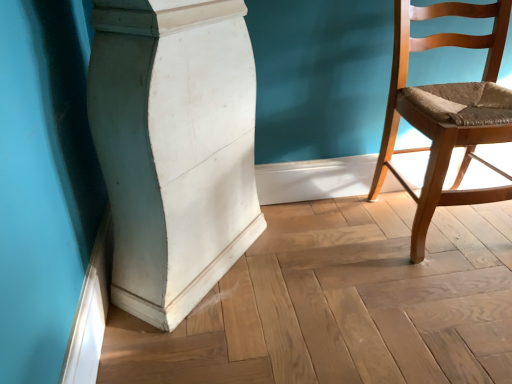
This screenshot has width=512, height=384. What do you see at coordinates (438, 121) in the screenshot?
I see `light brown wooden chair at right` at bounding box center [438, 121].

Where is `light brown wooden chair at right`? light brown wooden chair at right is located at coordinates (438, 121).

What is the approximate width of white matte/wooden pillar at center?

The width of white matte/wooden pillar at center is 21.98 inches.

Based on the photo, in order to face white matte/wooden pillar at center, should I rotate leftwards or rightwards?

Turn left approximately 8.371 degrees to face it.

Image resolution: width=512 pixels, height=384 pixels. Describe the element at coordinates (174, 147) in the screenshot. I see `white matte/wooden pillar at center` at that location.

At what (x,y) coordinates should I click in order to perform the action: click on white matte/wooden pillar at center. Please return your answer as a coordinate pair (x, y). The height and width of the screenshot is (384, 512). Looking at the image, I should click on (174, 147).

Locate an element on the screen. light brown wooden chair at right is located at coordinates (438, 121).

Consider the image. Is light brown wooden chair at right to the left of white matte/wooden pillar at center from the viewer's perspective?

No, light brown wooden chair at right is not to the left of white matte/wooden pillar at center.

Relative to white matte/wooden pillar at center, is light brown wooden chair at right in front or behind?

Visually, light brown wooden chair at right is located behind white matte/wooden pillar at center.

Between point (462, 169) and point (139, 273), which one is positioned behind?

Point (462, 169)

From the image's perspective, is light brown wooden chair at right under white matte/wooden pillar at center?

No, from the image's perspective, light brown wooden chair at right is not below white matte/wooden pillar at center.

From a real-world perspective, is light brown wooden chair at right physically above white matte/wooden pillar at center?

Incorrect, from a real-world perspective, light brown wooden chair at right is lower than white matte/wooden pillar at center.

Does light brown wooden chair at right have a greater width compared to white matte/wooden pillar at center?

Incorrect, the width of light brown wooden chair at right does not surpass that of white matte/wooden pillar at center.

Considering the sizes of objects light brown wooden chair at right and white matte/wooden pillar at center in the image provided, who is taller, light brown wooden chair at right or white matte/wooden pillar at center?

white matte/wooden pillar at center is taller.

Does light brown wooden chair at right have a larger size compared to white matte/wooden pillar at center?

Actually, light brown wooden chair at right might be smaller than white matte/wooden pillar at center.

From the picture: Do you think light brown wooden chair at right is within white matte/wooden pillar at center, or outside of it?

light brown wooden chair at right is not enclosed by white matte/wooden pillar at center.

Based on the photo, is light brown wooden chair at right positioned far away from white matte/wooden pillar at center?

No, light brown wooden chair at right is not far from white matte/wooden pillar at center.

Is light brown wooden chair at right turned away from white matte/wooden pillar at center?

That's not correct — light brown wooden chair at right is not looking away from white matte/wooden pillar at center.

Locate an element on the screen. The height and width of the screenshot is (384, 512). chair beneath the white matte/wooden pillar at center (from a real-world perspective) is located at coordinates (438, 121).

Based on their positions, is white matte/wooden pillar at center located to the left or right of light brown wooden chair at right?

white matte/wooden pillar at center is to the left of light brown wooden chair at right.

Which object is further away from the camera, white matte/wooden pillar at center or light brown wooden chair at right?

light brown wooden chair at right is further from the camera.

Is point (217, 252) positioned before point (388, 120)?

Yes, point (217, 252) is in front of point (388, 120).

From the image's perspective, relative to light brown wooden chair at right, is white matte/wooden pillar at center above or below?

white matte/wooden pillar at center is situated lower than light brown wooden chair at right in the image.

From a real-world perspective, is white matte/wooden pillar at center physically above light brown wooden chair at right?

Yes, from a real-world perspective, white matte/wooden pillar at center is over light brown wooden chair at right

In the scene shown: Between white matte/wooden pillar at center and light brown wooden chair at right, which one has smaller width?

Thinner between the two is light brown wooden chair at right.

Which of these two, white matte/wooden pillar at center or light brown wooden chair at right, stands taller?

With more height is white matte/wooden pillar at center.

Which of these two, white matte/wooden pillar at center or light brown wooden chair at right, is smaller?

light brown wooden chair at right.

Is light brown wooden chair at right surrounded by white matte/wooden pillar at center?

No, light brown wooden chair at right is not inside white matte/wooden pillar at center.

Would you consider white matte/wooden pillar at center to be distant from light brown wooden chair at right?

Actually, white matte/wooden pillar at center and light brown wooden chair at right are a little close together.

Is white matte/wooden pillar at center oriented towards light brown wooden chair at right?

Yes, white matte/wooden pillar at center is aimed at light brown wooden chair at right.

Measure the distance between white matte/wooden pillar at center and light brown wooden chair at right.

white matte/wooden pillar at center and light brown wooden chair at right are 26.85 inches apart from each other.

At what (x,y) coordinates should I click in order to perform the action: click on pillar to the left of light brown wooden chair at right. Please return your answer as a coordinate pair (x, y). Looking at the image, I should click on (174, 147).

Where is `pillar positioned vertically above the light brown wooden chair at right (from a real-world perspective)`? The image size is (512, 384). pillar positioned vertically above the light brown wooden chair at right (from a real-world perspective) is located at coordinates (174, 147).

Image resolution: width=512 pixels, height=384 pixels. Identify the location of pillar that is in front of the light brown wooden chair at right. pyautogui.click(x=174, y=147).